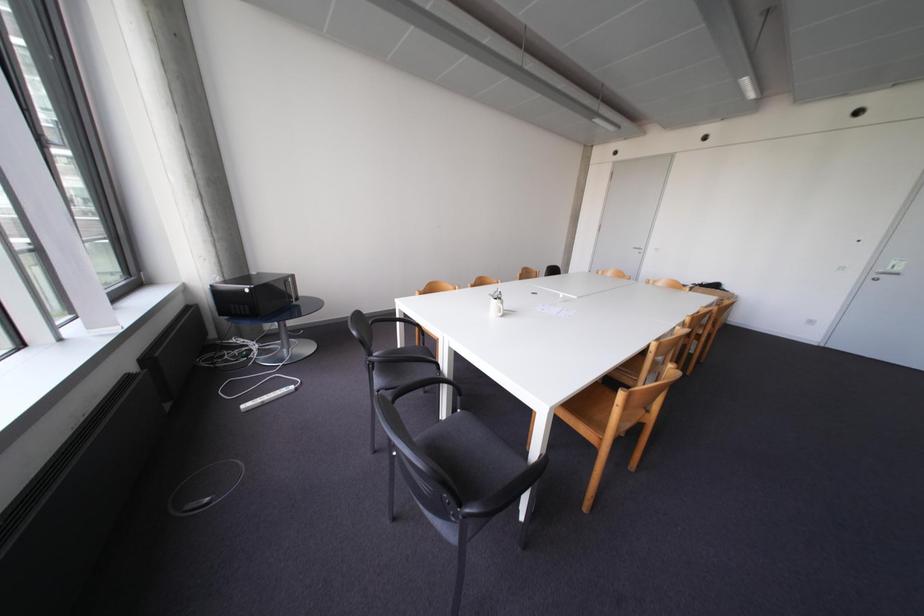
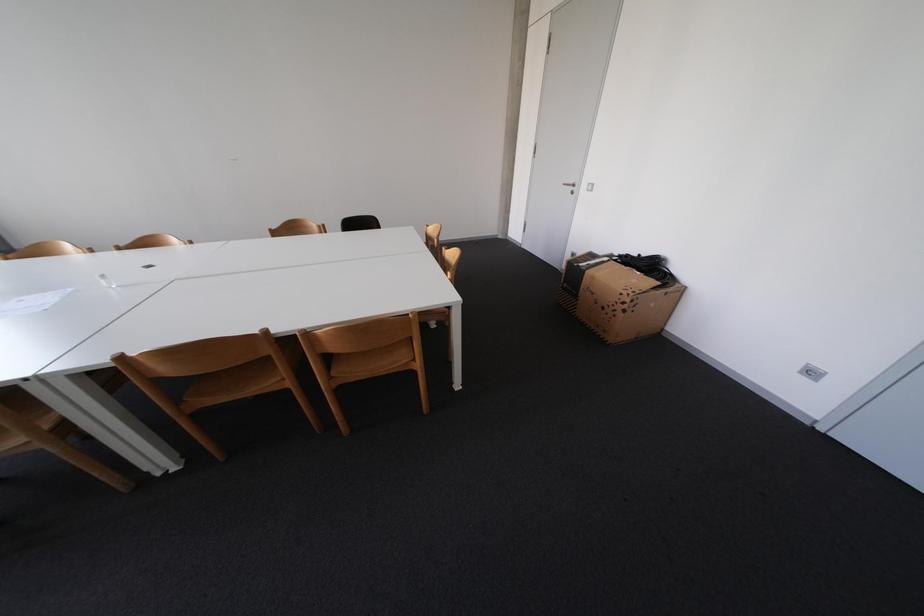
In a continuous first-person perspective shot, in which direction is the camera moving?

The cameraman moved toward right, forward.